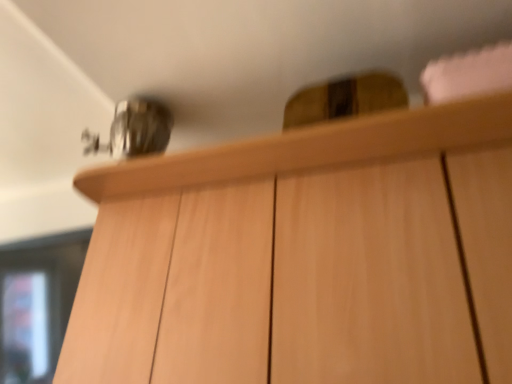
Question: Is light wood cabinet at upper center thinner than transparent glass door at lower left?

Choices:
 (A) yes
 (B) no

Answer: (B)

Question: From a real-world perspective, is light wood cabinet at upper center on top of transparent glass door at lower left?

Choices:
 (A) no
 (B) yes

Answer: (B)

Question: Is light wood cabinet at upper center oriented towards transparent glass door at lower left?

Choices:
 (A) no
 (B) yes

Answer: (A)

Question: Can you confirm if light wood cabinet at upper center is positioned to the right of transparent glass door at lower left?

Choices:
 (A) no
 (B) yes

Answer: (B)

Question: Is light wood cabinet at upper center bigger than transparent glass door at lower left?

Choices:
 (A) yes
 (B) no

Answer: (A)

Question: Does light wood cabinet at upper center come behind transparent glass door at lower left?

Choices:
 (A) no
 (B) yes

Answer: (A)

Question: Would you say transparent glass door at lower left contains light wood cabinet at upper center?

Choices:
 (A) no
 (B) yes

Answer: (A)

Question: From the image's perspective, is transparent glass door at lower left under light wood cabinet at upper center?

Choices:
 (A) no
 (B) yes

Answer: (B)

Question: Does transparent glass door at lower left have a greater width compared to light wood cabinet at upper center?

Choices:
 (A) yes
 (B) no

Answer: (B)

Question: Can you confirm if transparent glass door at lower left is positioned to the left of light wood cabinet at upper center?

Choices:
 (A) no
 (B) yes

Answer: (B)

Question: From the image's perspective, is transparent glass door at lower left located above light wood cabinet at upper center?

Choices:
 (A) yes
 (B) no

Answer: (B)

Question: From a real-world perspective, is transparent glass door at lower left under light wood cabinet at upper center?

Choices:
 (A) no
 (B) yes

Answer: (B)

Question: Considering the positions of light wood cabinet at upper center and transparent glass door at lower left in the image, is light wood cabinet at upper center taller or shorter than transparent glass door at lower left?

Choices:
 (A) short
 (B) tall

Answer: (B)